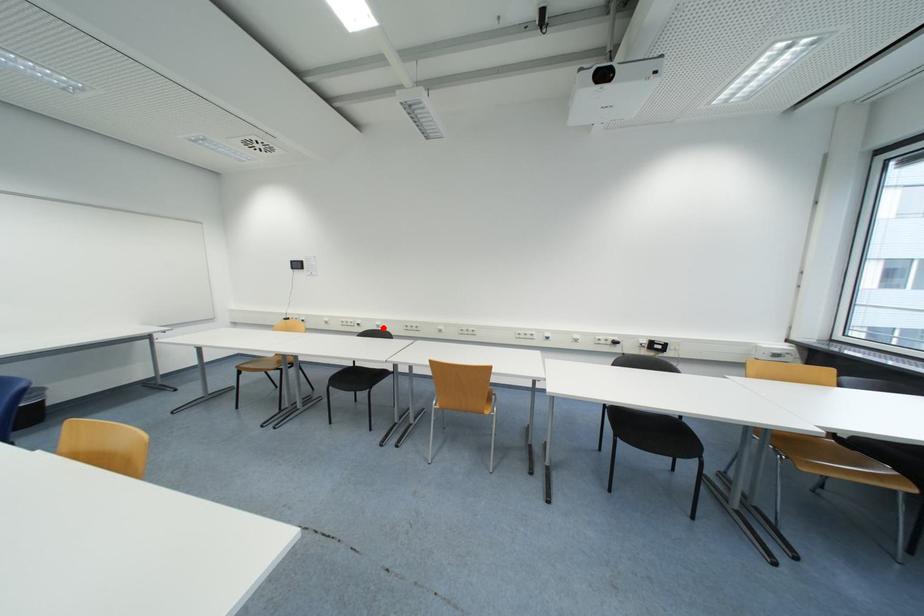
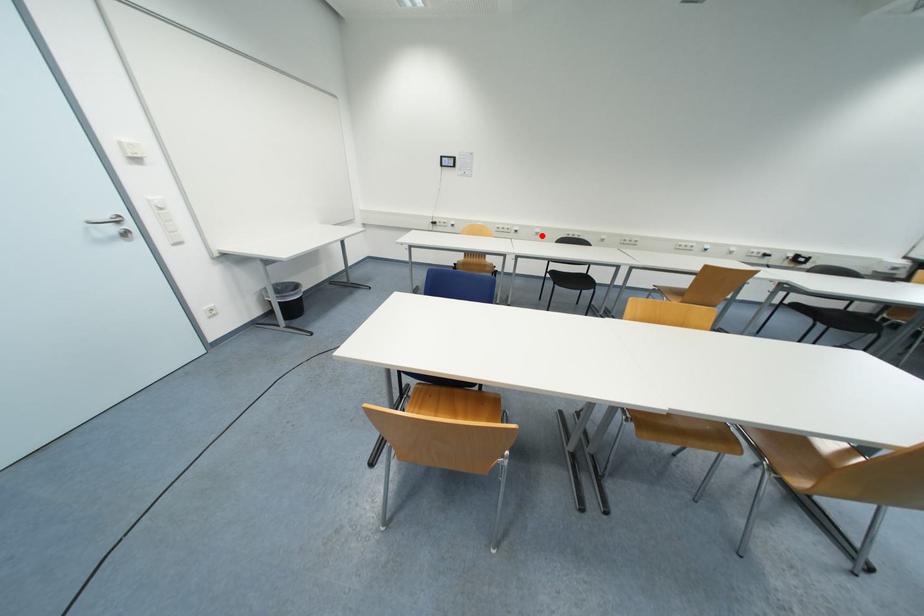
I am providing you with two images of the same scene from different viewpoints. A red point is marked on the first image and another point is marked on the second image. Are the points marked in image1 and image2 representing the same 3D position?

Yes